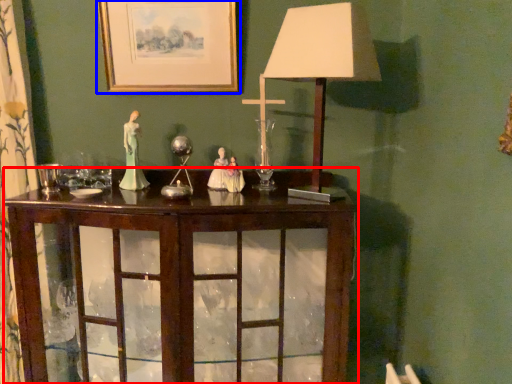
Question: Which of the following is the closest to the observer, table (highlighted by a red box) or picture frame (highlighted by a blue box)?

Choices:
 (A) table
 (B) picture frame

Answer: (A)